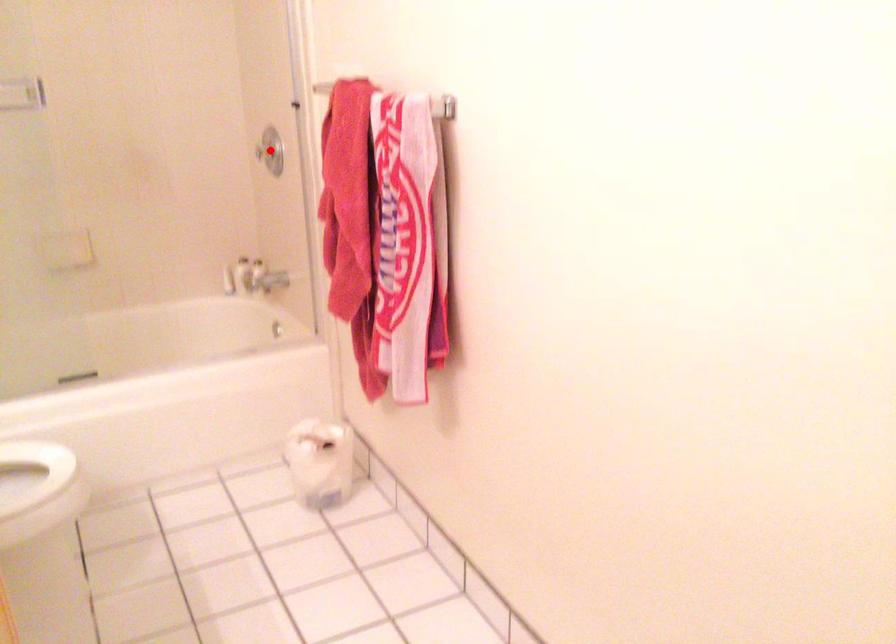
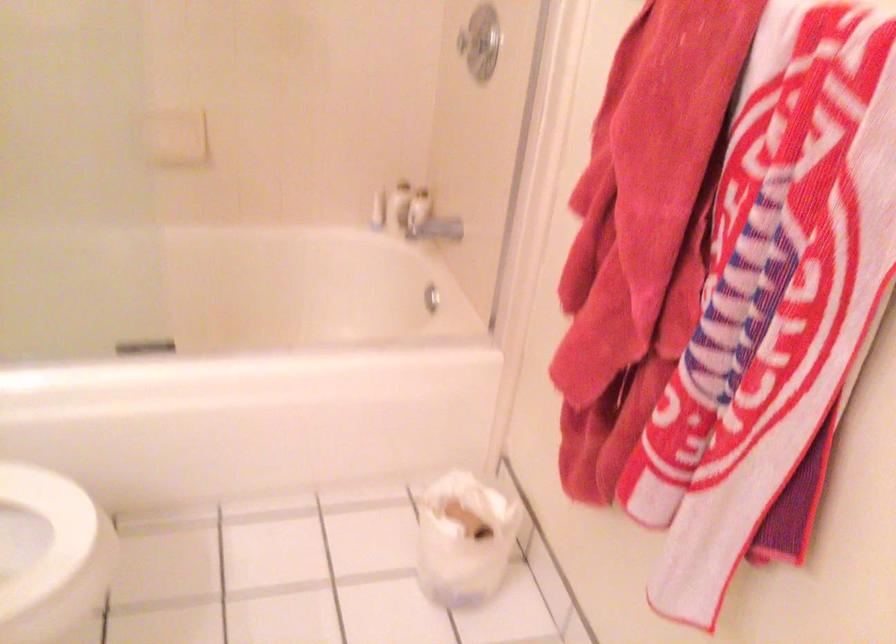
The point at the highlighted location is marked in the first image. Where is the corresponding point in the second image?

(478, 42)